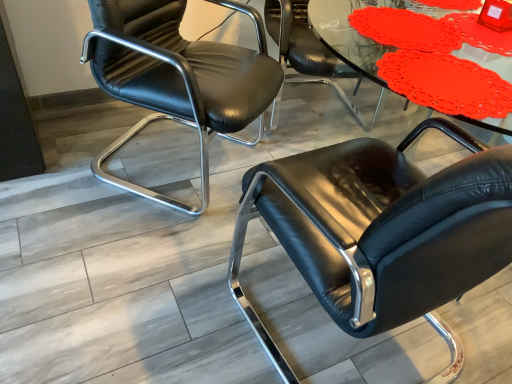
Question: Does matte plastic table at upper center appear on the right side of black leather chair at center, the first chair positioned from the right?

Choices:
 (A) yes
 (B) no

Answer: (B)

Question: Does matte plastic table at upper center turn towards black leather chair at center, the first chair positioned from the right?

Choices:
 (A) no
 (B) yes

Answer: (B)

Question: Is matte plastic table at upper center oriented away from black leather chair at center, the first chair positioned from the right?

Choices:
 (A) no
 (B) yes

Answer: (B)

Question: Is matte plastic table at upper center not close to black leather chair at center, the first chair positioned from the right?

Choices:
 (A) no
 (B) yes

Answer: (A)

Question: Can you confirm if matte plastic table at upper center is bigger than black leather chair at center, which appears as the third chair when viewed from the left?

Choices:
 (A) no
 (B) yes

Answer: (A)

Question: Would you say black leather chair at center, the first chair positioned from the right, is part of matte plastic table at upper center's contents?

Choices:
 (A) yes
 (B) no

Answer: (B)

Question: Is black leather chair at center, the first chair positioned from the right, located outside black leather chair at left, placed as the 1th chair when sorted from left to right?

Choices:
 (A) yes
 (B) no

Answer: (A)

Question: Is black leather chair at center, the first chair positioned from the right, oriented away from black leather chair at left, placed as the 1th chair when sorted from left to right?

Choices:
 (A) no
 (B) yes

Answer: (A)

Question: Would you say black leather chair at left, placed as the 1th chair when sorted from left to right, is part of black leather chair at center, the first chair positioned from the right,'s contents?

Choices:
 (A) no
 (B) yes

Answer: (A)

Question: From a real-world perspective, is black leather chair at center, which appears as the third chair when viewed from the left, located higher than black leather chair at left, marked as the 3th chair in a right-to-left arrangement?

Choices:
 (A) yes
 (B) no

Answer: (B)

Question: Considering the relative sizes of black leather chair at center, which appears as the third chair when viewed from the left, and black leather chair at left, marked as the 3th chair in a right-to-left arrangement, in the image provided, is black leather chair at center, which appears as the third chair when viewed from the left, bigger than black leather chair at left, marked as the 3th chair in a right-to-left arrangement,?

Choices:
 (A) yes
 (B) no

Answer: (A)

Question: Considering the relative sizes of black leather chair at center, the first chair positioned from the right, and black leather chair at left, placed as the 1th chair when sorted from left to right, in the image provided, is black leather chair at center, the first chair positioned from the right, wider than black leather chair at left, placed as the 1th chair when sorted from left to right,?

Choices:
 (A) no
 (B) yes

Answer: (B)

Question: Would you consider black leather chair at center, which appears as the third chair when viewed from the left, to be distant from matte plastic table at upper center?

Choices:
 (A) yes
 (B) no

Answer: (B)